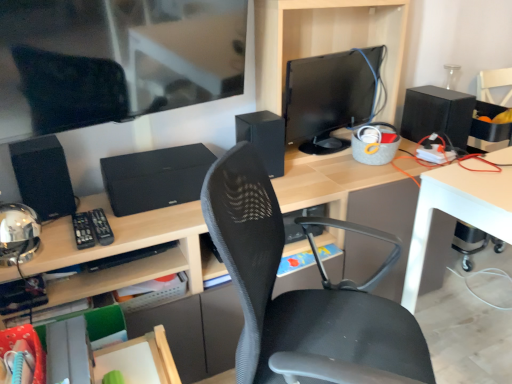
What do you see at coordinates (330, 97) in the screenshot?
I see `matte black monitor at center` at bounding box center [330, 97].

How much space does black matte speaker at center, acting as the 2th speaker starting from the back, occupy vertically?

black matte speaker at center, acting as the 2th speaker starting from the back, is 9.90 inches in height.

Measure the distance between black matte speaker at center, the 2th speaker from the left, and camera.

The depth of black matte speaker at center, the 2th speaker from the left, is 1.54 meters.

Locate an element on the screen. This screenshot has width=512, height=384. white glossy table at lower right is located at coordinates pos(458,210).

Where is `black textured speaker at center`? The width and height of the screenshot is (512, 384). black textured speaker at center is located at coordinates (155, 178).

Where is `black matte speaker at right, the 3th speaker viewed from the left`? This screenshot has height=384, width=512. black matte speaker at right, the 3th speaker viewed from the left is located at coordinates pos(437,114).

Identify the location of matte black monitor at center. This screenshot has width=512, height=384. (330, 97).

Considering the relative sizes of white glossy table at lower right and matte black desk at center in the image provided, is white glossy table at lower right shorter than matte black desk at center?

Indeed, white glossy table at lower right has a lesser height compared to matte black desk at center.

Is white glossy table at lower right to the right of matte black desk at center from the viewer's perspective?

Yes.

In the scene shown: Is white glossy table at lower right far from matte black desk at center?

No.

Is matte black desk at center surrounded by white glossy table at lower right?

No.

Considering the sizes of objects matte black monitor at center and black matte speaker at right, which ranks as the 3th speaker in front-to-back order, in the image provided, who is shorter, matte black monitor at center or black matte speaker at right, which ranks as the 3th speaker in front-to-back order,?

With less height is black matte speaker at right, which ranks as the 3th speaker in front-to-back order.

Is black matte speaker at right, which is the 1th speaker in back-to-front order, at the back of matte black monitor at center?

No, matte black monitor at center's orientation is not away from black matte speaker at right, which is the 1th speaker in back-to-front order.

Is there a large distance between matte black monitor at center and black matte speaker at right, the 3th speaker viewed from the left?

No.

From the image's perspective, which one is positioned lower, matte black monitor at center or black matte speaker at right, which ranks as the 3th speaker in front-to-back order?

black matte speaker at right, which ranks as the 3th speaker in front-to-back order, appears lower in the image.

Considering the positions of objects black matte speaker at center, acting as the 2th speaker starting from the back, and matte black desk at center in the image provided, who is more to the left, black matte speaker at center, acting as the 2th speaker starting from the back, or matte black desk at center?

Positioned to the left is matte black desk at center.

Identify the location of desk that is in front of the black matte speaker at center, which is the 2th speaker in front-to-back order. (127, 250).

Does point (274, 160) come farther from viewer compared to point (307, 197)?

Yes.

From a real-world perspective, is black matte speaker at center, which is the 2th speaker in right-to-left order, on matte black desk at center?

Yes.

Between black matte speaker at center, which is the 2th speaker in front-to-back order, and black matte speaker at right, acting as the first speaker starting from the right, which one appears on the left side from the viewer's perspective?

black matte speaker at center, which is the 2th speaker in front-to-back order, is more to the left.

From the image's perspective, between black matte speaker at center, which is the 2th speaker in right-to-left order, and black matte speaker at right, which ranks as the 3th speaker in front-to-back order, which one is located above?

black matte speaker at right, which ranks as the 3th speaker in front-to-back order, from the image's perspective.

Does black matte speaker at center, which is the 2th speaker in right-to-left order, come behind black matte speaker at right, which is the 1th speaker in back-to-front order?

No, black matte speaker at center, which is the 2th speaker in right-to-left order, is closer to the viewer.

Can you tell me how much white glossy table at lower right and black matte speaker at right, the 3th speaker viewed from the left, differ in facing direction?

The angle between the facing direction of white glossy table at lower right and the facing direction of black matte speaker at right, the 3th speaker viewed from the left, is 3.43 degrees.

Is white glossy table at lower right bigger than black matte speaker at right, which ranks as the 3th speaker in front-to-back order?

Correct, white glossy table at lower right is larger in size than black matte speaker at right, which ranks as the 3th speaker in front-to-back order.

From the image's perspective, would you say white glossy table at lower right is positioned over black matte speaker at right, the 3th speaker viewed from the left?

No, from the image's perspective, white glossy table at lower right is not above black matte speaker at right, the 3th speaker viewed from the left.

Which is in front, point (493, 174) or point (429, 99)?

Point (493, 174)

Is the depth of black matte speaker at center, the 2th speaker from the left, less than that of white glossy table at lower right?

No, black matte speaker at center, the 2th speaker from the left, is behind white glossy table at lower right.

Is black matte speaker at center, which is the 2th speaker in front-to-back order, facing towards white glossy table at lower right?

No, black matte speaker at center, which is the 2th speaker in front-to-back order, is not facing towards white glossy table at lower right.

From the image's perspective, is black matte speaker at center, the 2th speaker from the left, below white glossy table at lower right?

Actually, black matte speaker at center, the 2th speaker from the left, appears above white glossy table at lower right in the image.

Between black matte speaker at center, which is the 2th speaker in right-to-left order, and white glossy table at lower right, which one has more height?

With more height is white glossy table at lower right.

Is matte black desk at center next to black matte speaker at center, which is the 2th speaker in front-to-back order?

No, matte black desk at center is not with black matte speaker at center, which is the 2th speaker in front-to-back order.

Which is less distant, (391, 282) or (269, 154)?

Point (391, 282) appears to be farther away from the viewer than point (269, 154).

Considering the relative sizes of matte black desk at center and black matte speaker at center, acting as the 2th speaker starting from the back, in the image provided, is matte black desk at center wider than black matte speaker at center, acting as the 2th speaker starting from the back,?

Yes, matte black desk at center is wider than black matte speaker at center, acting as the 2th speaker starting from the back.

Where is `desk in front of the white glossy table at lower right`? desk in front of the white glossy table at lower right is located at coordinates (127, 250).

You are a GUI agent. You are given a task and a screenshot of the screen. Output one action in this format:
    pyautogui.click(x=<x>, y=<y>)
    Task: Click on the speaker on the right side of matte black monitor at center
    Image resolution: width=512 pixels, height=384 pixels.
    Given the screenshot: What is the action you would take?
    pyautogui.click(x=437, y=114)

Which object lies further to the anchor point black matte speaker at center, which is the 2th speaker in right-to-left order, matte black monitor at center or black textured speaker at center?

Among the two, black textured speaker at center is located further to black matte speaker at center, which is the 2th speaker in right-to-left order.

Based on their spatial positions, is black textured speaker at center or black matte speaker at right, which ranks as the 3th speaker in front-to-back order, further from black matte speaker at center, the 2th speaker from the left?

black matte speaker at right, which ranks as the 3th speaker in front-to-back order, is further to black matte speaker at center, the 2th speaker from the left.

Based on their spatial positions, is black matte speaker at left, which appears as the first speaker when viewed from the left, or black matte speaker at center, acting as the 2th speaker starting from the back, closer to black matte speaker at right, acting as the first speaker starting from the right?

black matte speaker at center, acting as the 2th speaker starting from the back, lies closer to black matte speaker at right, acting as the first speaker starting from the right, than the other object.

Estimate the real-world distances between objects in this image. Which object is further from black matte speaker at center, which is the 2th speaker in right-to-left order, black matte speaker at right, acting as the first speaker starting from the right, or matte black monitor at center?

black matte speaker at right, acting as the first speaker starting from the right, lies further to black matte speaker at center, which is the 2th speaker in right-to-left order, than the other object.

Considering their positions, is black matte speaker at center, the 2th speaker from the left, positioned closer to black matte speaker at left, which appears as the first speaker when viewed from the left, than black textured speaker at center?

The object closer to black matte speaker at left, which appears as the first speaker when viewed from the left, is black textured speaker at center.

Based on the photo, which object lies nearer to the anchor point black matte speaker at left, placed as the third speaker when sorted from right to left, black textured speaker at center or matte black monitor at center?

black textured speaker at center lies closer to black matte speaker at left, placed as the third speaker when sorted from right to left, than the other object.

Which object lies further to the anchor point black matte speaker at center, acting as the 2th speaker starting from the back, white glossy table at lower right or black matte speaker at right, which is the 1th speaker in back-to-front order?

A: Among the two, black matte speaker at right, which is the 1th speaker in back-to-front order, is located further to black matte speaker at center, acting as the 2th speaker starting from the back.

Based on their spatial positions, is black matte speaker at center, which is the 2th speaker in right-to-left order, or matte black desk at center further from matte black monitor at center?

matte black desk at center is further to matte black monitor at center.

The height and width of the screenshot is (384, 512). I want to click on desk between black matte speaker at left, acting as the 3th speaker starting from the back, and black matte speaker at center, acting as the 2th speaker starting from the back, so click(127, 250).

This screenshot has height=384, width=512. I want to click on computer located between matte black desk at center and matte black monitor at center in the depth direction, so click(x=155, y=178).

What are the coordinates of `speaker between black textured speaker at center and matte black monitor at center in the horizontal direction` in the screenshot? It's located at point(264,138).

Identify the location of computer between black matte speaker at left, placed as the third speaker when sorted from right to left, and matte black desk at center from left to right. The height and width of the screenshot is (384, 512). (155, 178).